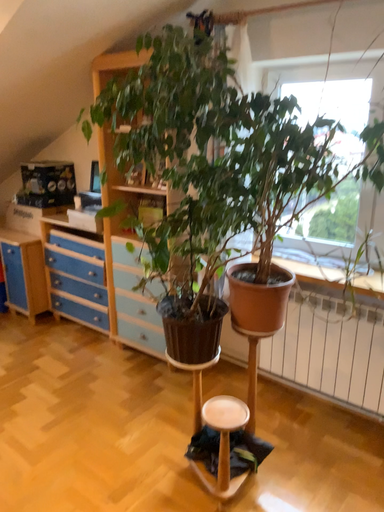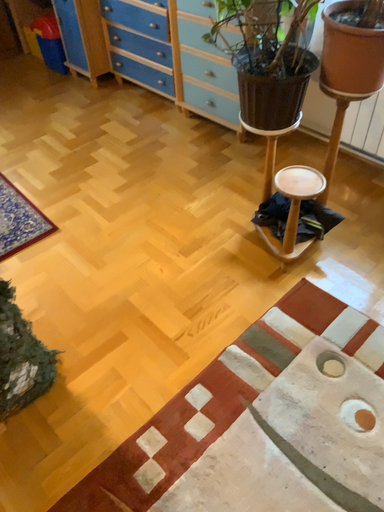
Question: Which way did the camera rotate in the video?

Choices:
 (A) rotated downward
 (B) rotated upward

Answer: (A)